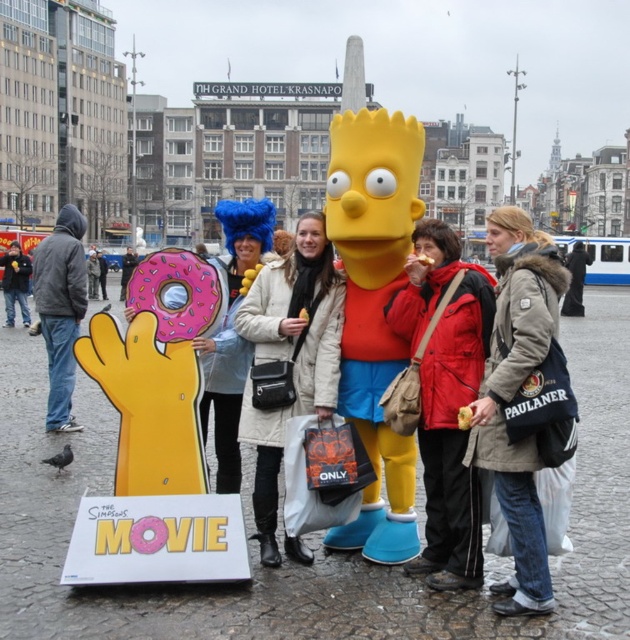
From the picture: You are standing at the point with coordinates point (9, 259) and want to walk to the point with coordinates point (413, 259). Which direction should you move in to reach your destination?

You should move forward because point (413, 259) is in front of point (9, 259).

You are a photographer at the public square and want to position a new tourist to the left of both the light brown leather jacket at center and the white wool coat at center. Is this possible?

The light brown leather jacket at center is to the right of the white wool coat at center, so the new tourist can be positioned to the left of both by placing them to the left of the white wool coat at center.